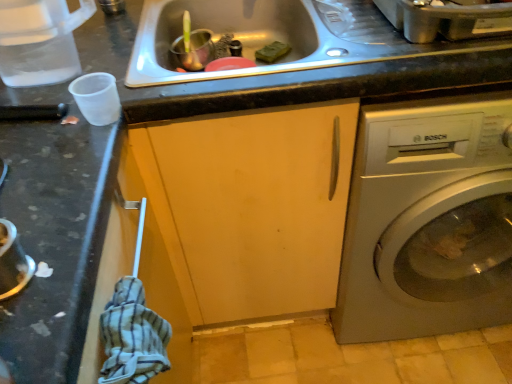
Question: Does satin silver washing machine at right have a greater width compared to matte wood cabinet at center?

Choices:
 (A) yes
 (B) no

Answer: (A)

Question: Is satin silver washing machine at right thinner than matte wood cabinet at center?

Choices:
 (A) yes
 (B) no

Answer: (B)

Question: From the image's perspective, is satin silver washing machine at right above matte wood cabinet at center?

Choices:
 (A) yes
 (B) no

Answer: (A)

Question: From the image's perspective, is satin silver washing machine at right beneath matte wood cabinet at center?

Choices:
 (A) no
 (B) yes

Answer: (A)

Question: From a real-world perspective, is satin silver washing machine at right below matte wood cabinet at center?

Choices:
 (A) no
 (B) yes

Answer: (B)

Question: Does satin silver washing machine at right have a lesser height compared to matte wood cabinet at center?

Choices:
 (A) no
 (B) yes

Answer: (B)

Question: From the image's perspective, is transparent plastic cup at left above stainless steel sink at center?

Choices:
 (A) no
 (B) yes

Answer: (A)

Question: Is transparent plastic cup at left oriented away from stainless steel sink at center?

Choices:
 (A) yes
 (B) no

Answer: (B)

Question: Is transparent plastic cup at left to the right of stainless steel sink at center from the viewer's perspective?

Choices:
 (A) no
 (B) yes

Answer: (A)

Question: Is the position of transparent plastic cup at left less distant than that of stainless steel sink at center?

Choices:
 (A) no
 (B) yes

Answer: (B)

Question: Does transparent plastic cup at left contain stainless steel sink at center?

Choices:
 (A) no
 (B) yes

Answer: (A)

Question: Are transparent plastic cup at left and stainless steel sink at center beside each other?

Choices:
 (A) no
 (B) yes

Answer: (A)

Question: Is transparent plastic cup at left positioned beyond the bounds of matte wood cabinet at center?

Choices:
 (A) yes
 (B) no

Answer: (A)